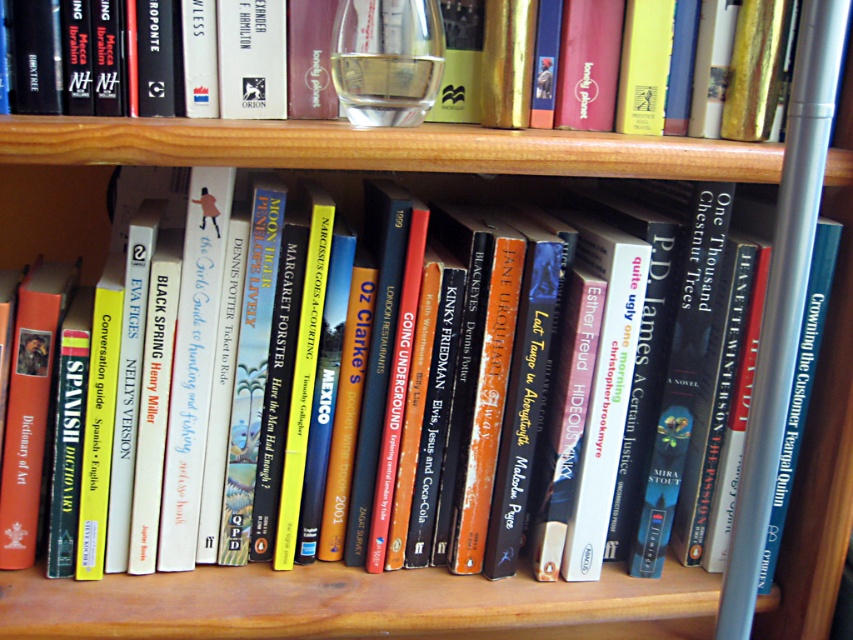
Question: Which object is farther from the camera taking this photo?

Choices:
 (A) gold hardcover book at upper center
 (B) clear glass wine glass at center

Answer: (B)

Question: Which point is closer to the camera?

Choices:
 (A) (373, 109)
 (B) (614, 100)

Answer: (A)

Question: Is gold hardcover book at upper center bigger than clear glass wine glass at center?

Choices:
 (A) no
 (B) yes

Answer: (B)

Question: Which of the following is the closest to the observer?

Choices:
 (A) clear glass wine glass at center
 (B) gold hardcover book at upper center

Answer: (B)

Question: Can you confirm if gold hardcover book at upper center is positioned below clear glass wine glass at center?

Choices:
 (A) yes
 (B) no

Answer: (B)

Question: Does gold hardcover book at upper center have a smaller size compared to clear glass wine glass at center?

Choices:
 (A) yes
 (B) no

Answer: (B)